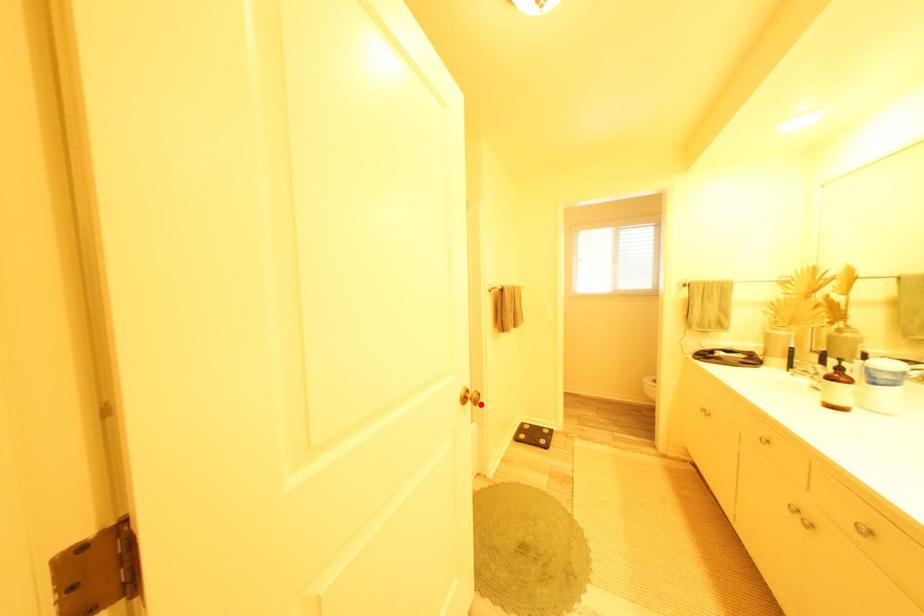
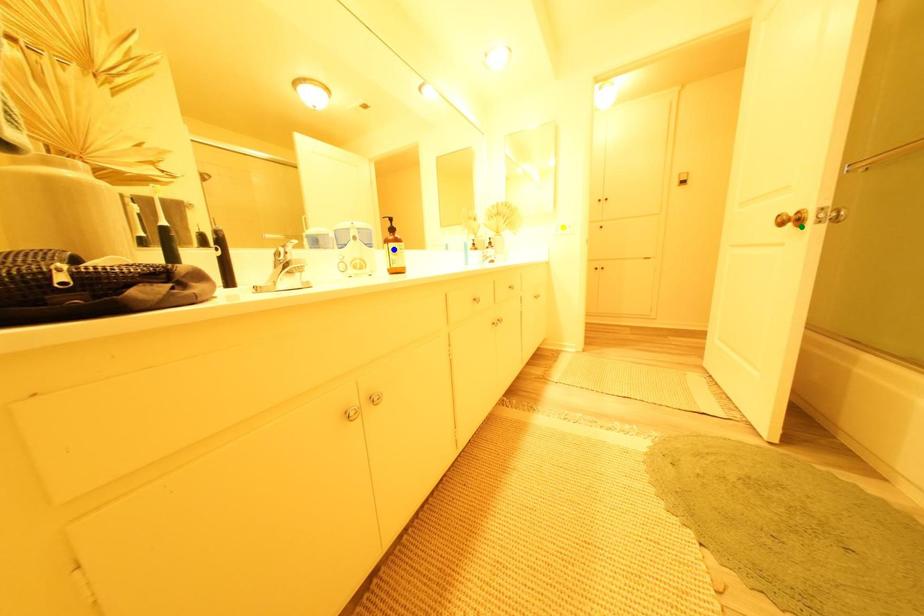
Question: I am providing you with two images of the same scene from different viewpoints. A red point is marked on the first image. You are given multiple points on the second image. In image 2, which mark is for the same physical point as the one in image 1?

Choices:
 (A) blue point
 (B) yellow point
 (C) green point

Answer: (C)